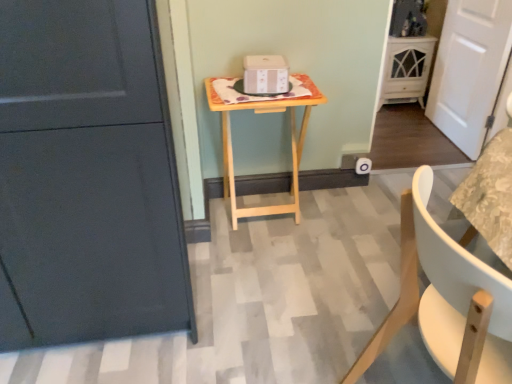
Question: Considering the relative positions of white wood chair at lower right and white wooden door at right in the image provided, is white wood chair at lower right to the left or to the right of white wooden door at right?

Choices:
 (A) left
 (B) right

Answer: (A)

Question: Which is correct: white wood chair at lower right is inside white wooden door at right, or outside of it?

Choices:
 (A) outside
 (B) inside

Answer: (A)

Question: Based on their relative distances, which object is farther from the light wood/texture table at center?

Choices:
 (A) white glossy cabinet at upper right
 (B) white wood chair at lower right
 (C) white wooden door at right

Answer: (A)

Question: Which object is the farthest from the light wood/texture table at center?

Choices:
 (A) white glossy cabinet at upper right
 (B) white wood chair at lower right
 (C) white wooden door at right

Answer: (A)